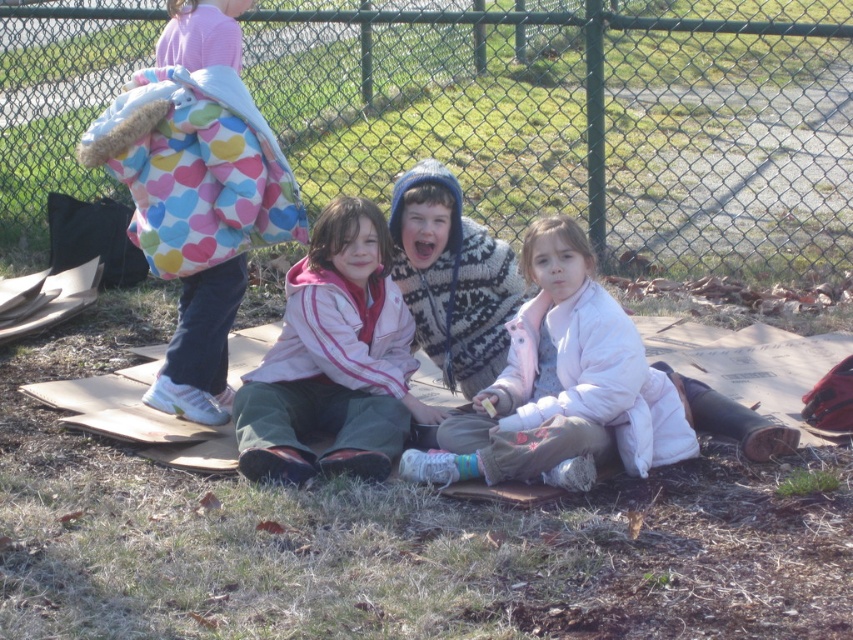
Between point (817, 61) and point (273, 461), which one is positioned behind?

The point (817, 61) is more distant.

Does metal chain-link fence at upper center have a smaller size compared to pink fleece jacket at center?

Actually, metal chain-link fence at upper center might be larger than pink fleece jacket at center.

Between point (718, 228) and point (292, 401), which one is positioned behind?

Point (718, 228)

Find the location of a particular element. metal chain-link fence at upper center is located at coordinates (583, 118).